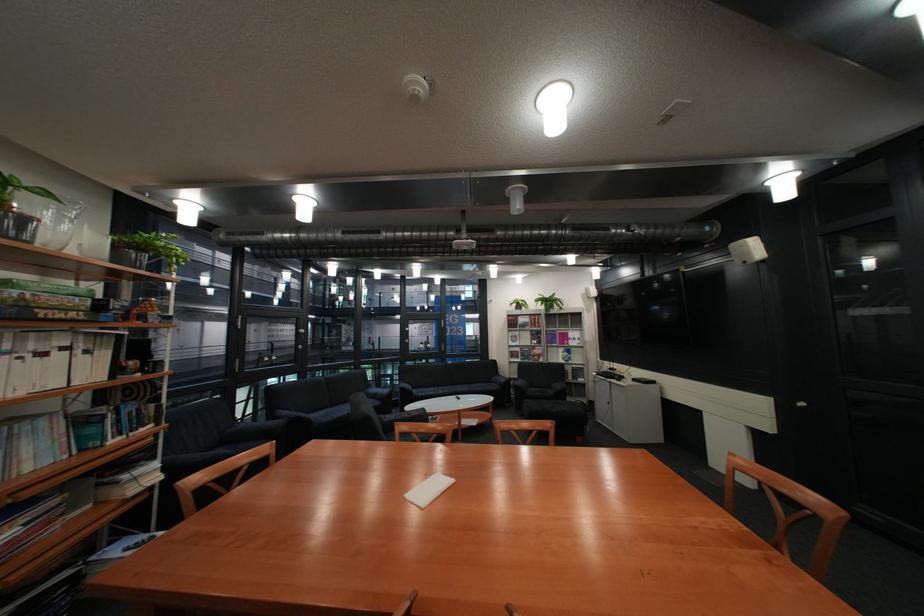
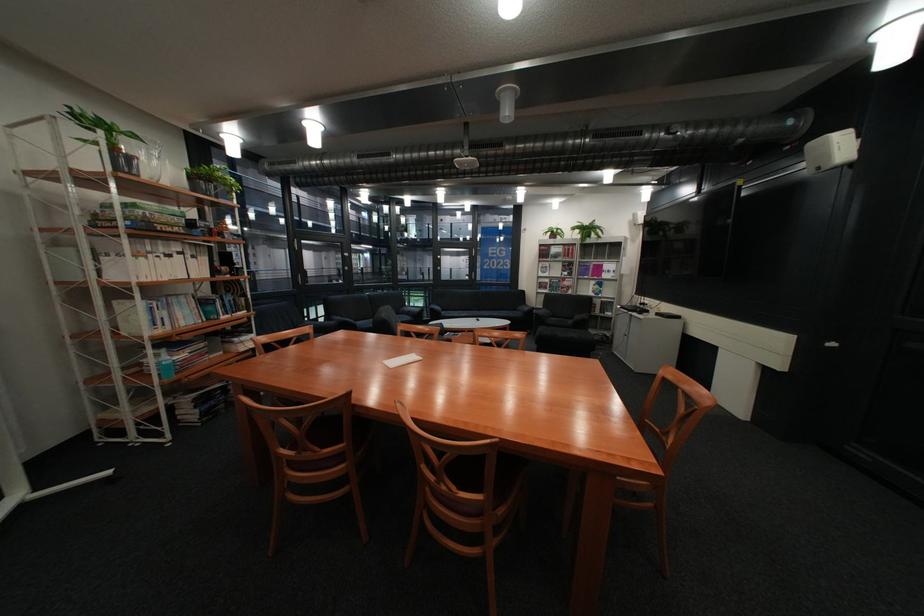
The point at (556,297) is marked in the first image. Where is the corresponding point in the second image?

(594, 225)